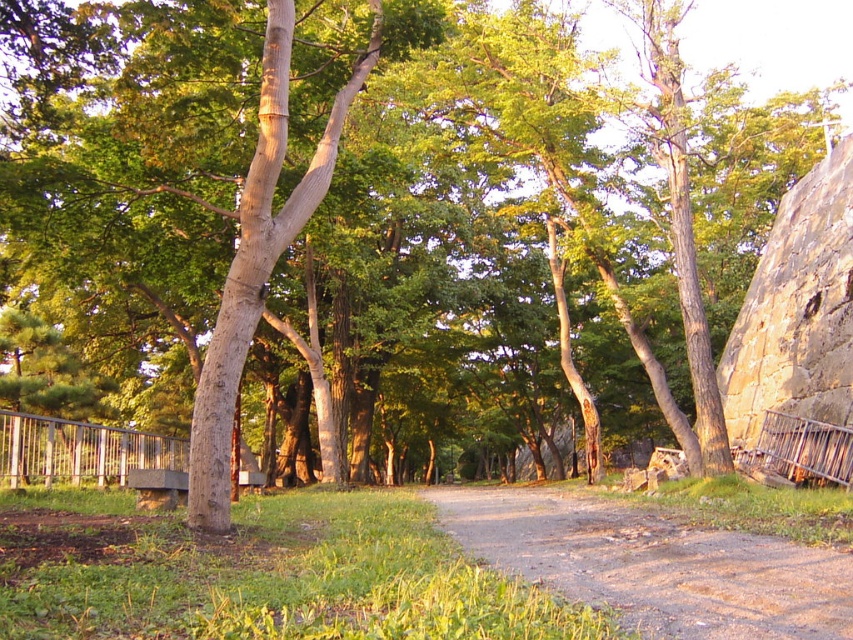
You are a gardener trying to decide whether to place a 2.5 meter wide decorative stone archway along the brown gravel path at center. The silver metallic rail at lower left is currently in the way. Based on their widths, can the archway fit on the path instead of the rail?

The brown gravel path at center is wider than the silver metallic rail at lower left. Since the path is wider, the 2.5 meter wide archway could potentially fit on the path if the path is at least 2.5 meters wide. However, the exact width of the path isn answer the question provides the comparison between the two objects but not the absolute width needed for the archway. Further measurement would be required to confirm.

You are planning to walk along the brown gravel path at center and the silver metallic rail at lower left. Which path is wider for walking?

The brown gravel path at center is bigger than silver metallic rail at lower left, so the brown gravel path at center is wider for walking.